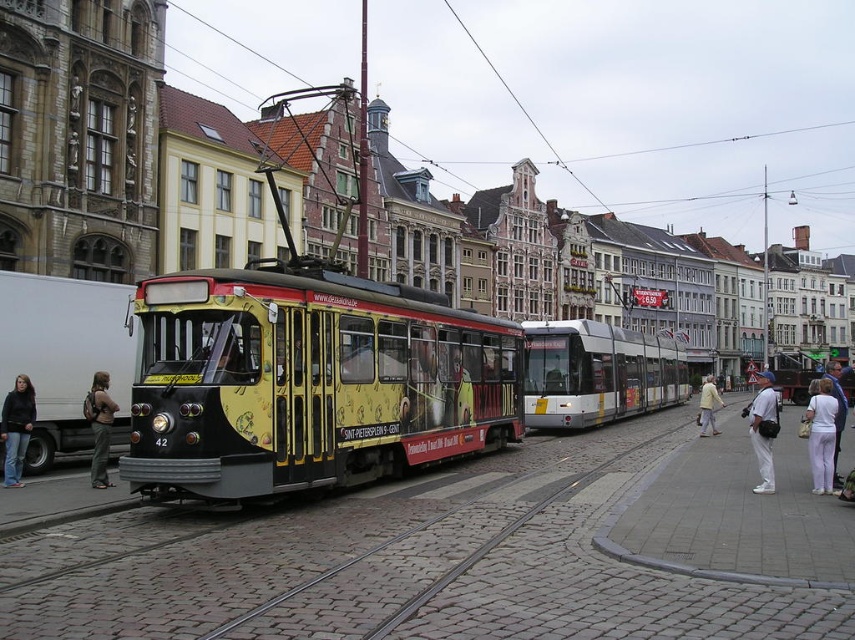
You are a photographer standing in the street scene and want to capture both the white cotton shirt at lower right and the light yellow jacket at center in a single frame. Which clothing item is wider so that it can be better highlighted in the photo?

The white cotton shirt at lower right is wider than the light yellow jacket at center, so it can be better highlighted in the photo.

You are a photographer standing on a cobblestone street in a European city. You notice a white cotton shirt at center and a dark gray backpack at left. Which object is taller when viewed from your position?

The white cotton shirt at center is taller than the dark gray backpack at left according to the description.